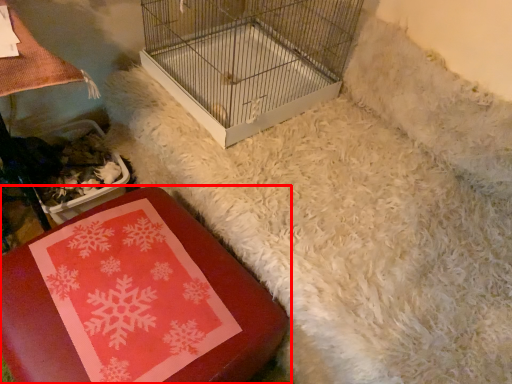
Question: From the image's perspective, where is furniture (annotated by the red box) located in relation to bird cage in the image?

Choices:
 (A) below
 (B) above

Answer: (A)